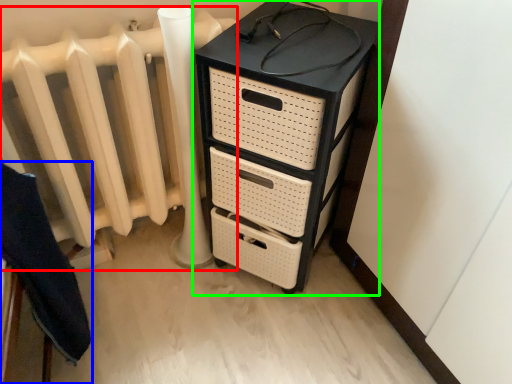
Question: Considering the real-world distances, which object is closest to radiator (highlighted by a red box)? furniture (highlighted by a blue box) or chest of drawers (highlighted by a green box).

Choices:
 (A) furniture
 (B) chest of drawers

Answer: (B)